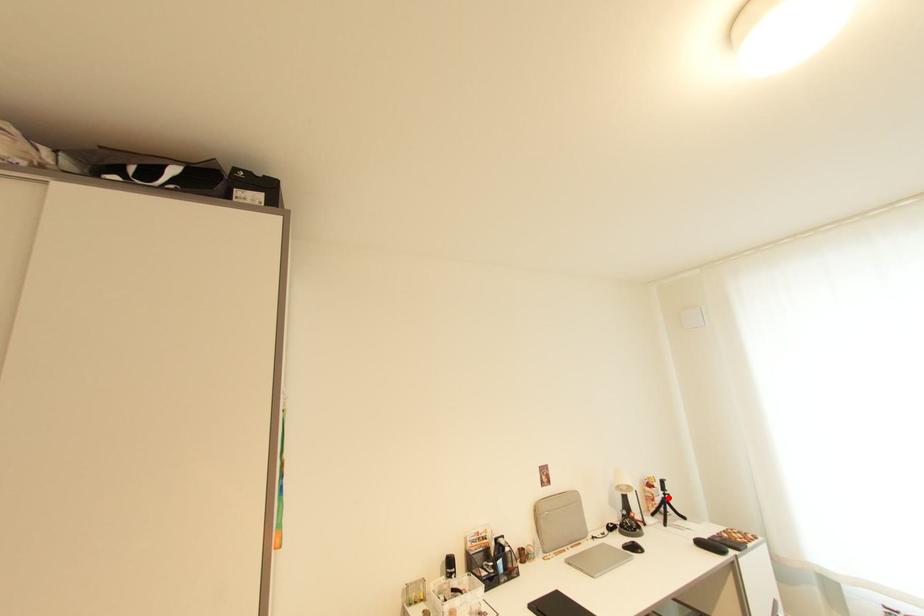
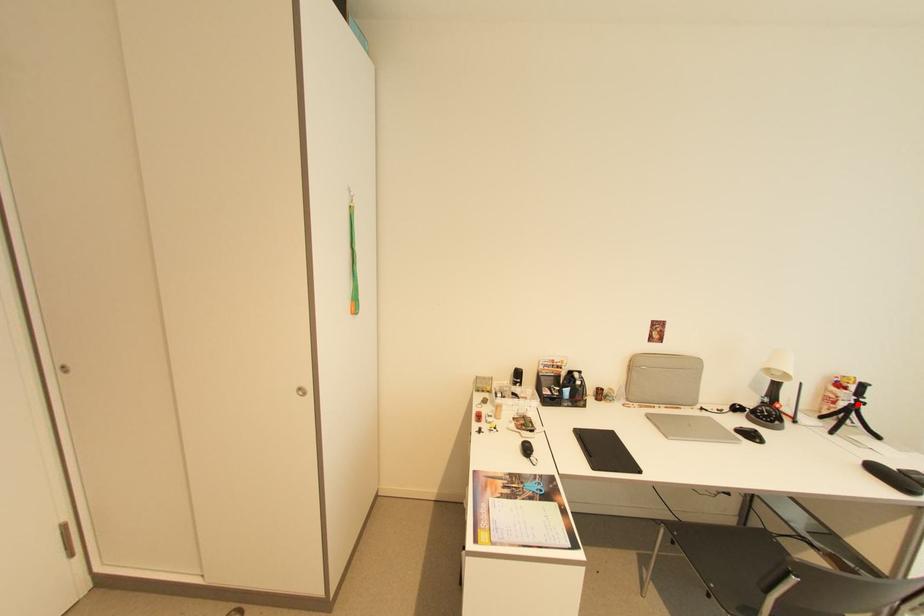
I am providing you with two images of the same scene from different viewpoints. A red point is marked on the first image and another point is marked on the second image. Is the red point in image1 aligned with the point shown in image2?

Yes